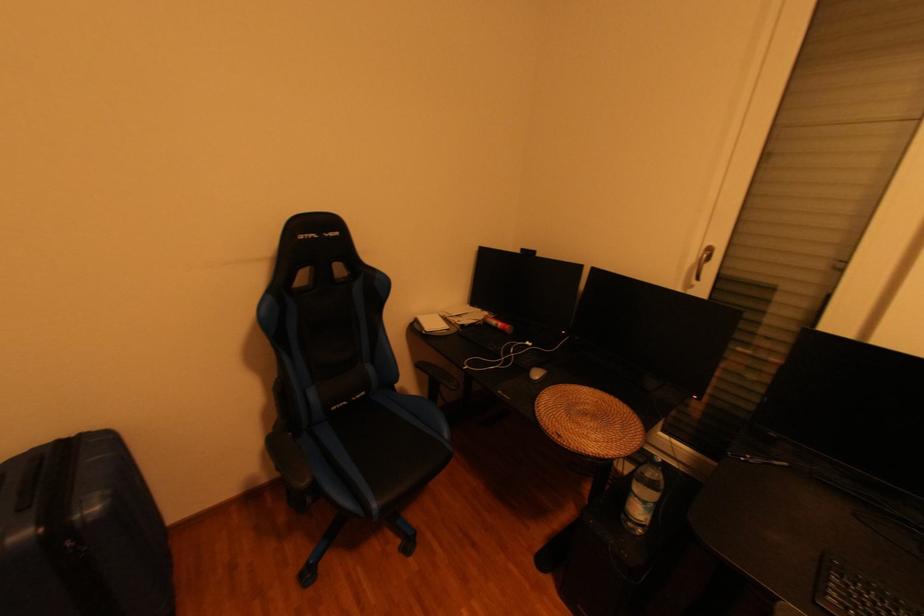
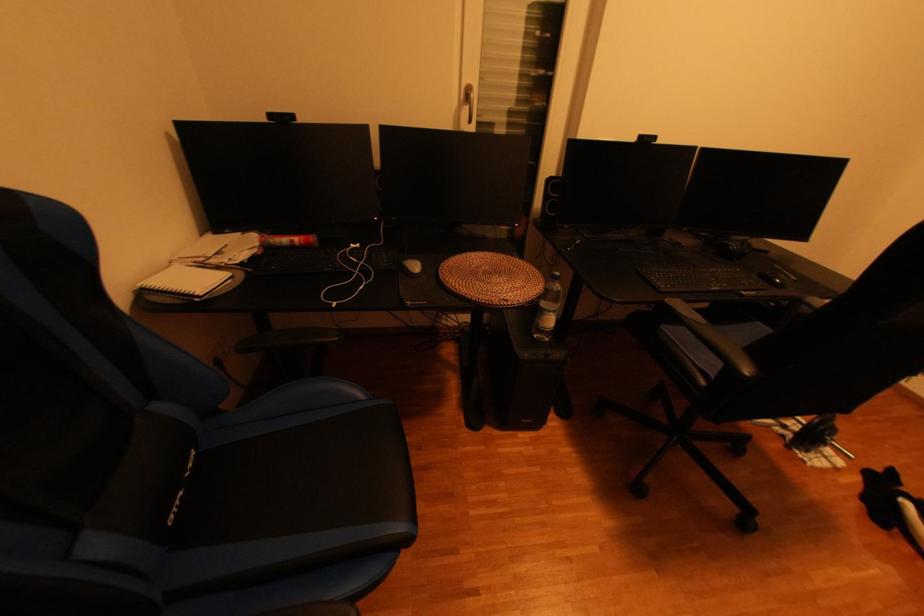
Question: I am providing you with two images of the same scene from different viewpoints. Please identify which objects are invisible in image2.

Choices:
 (A) gray computer mouse
 (B) white wired earbuds
 (C) plastic water bottle
 (D) none of these

Answer: (D)